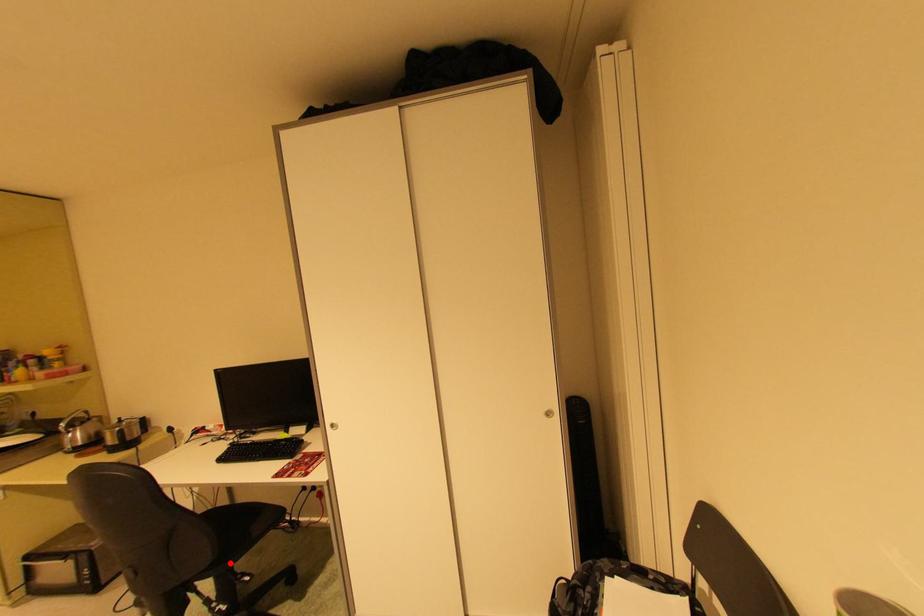
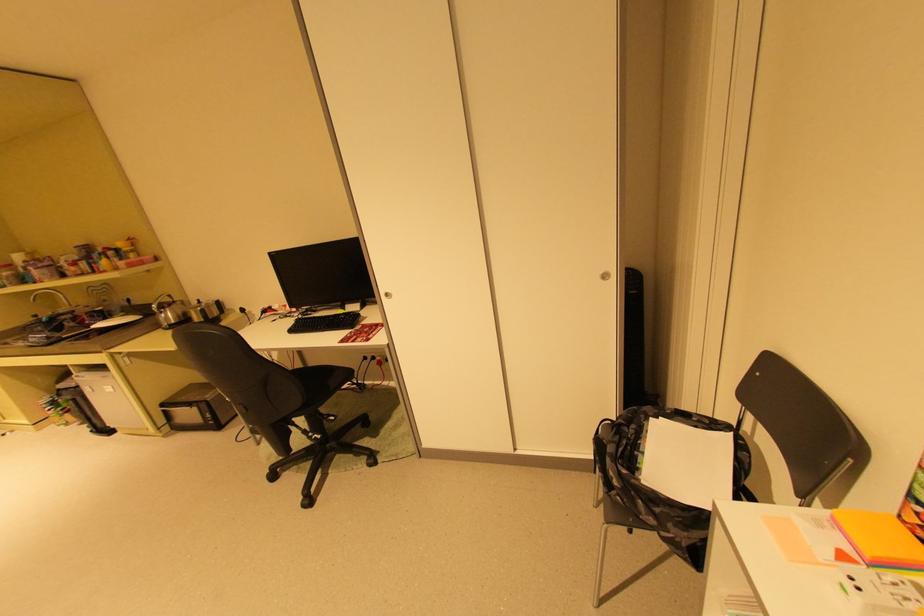
Locate, in the second image, the point that corresponds to the highlighted location in the first image.

(319, 408)